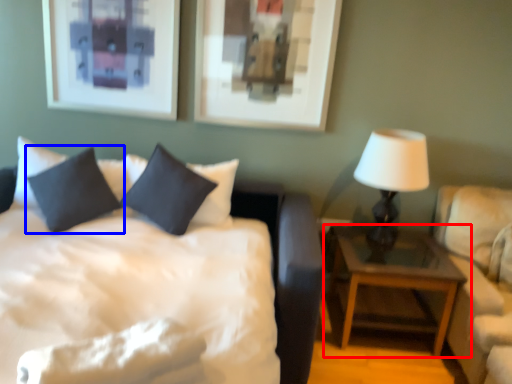
Question: Among these objects, which one is farthest to the camera, nightstand (highlighted by a red box) or pillow (highlighted by a blue box)?

Choices:
 (A) nightstand
 (B) pillow

Answer: (A)